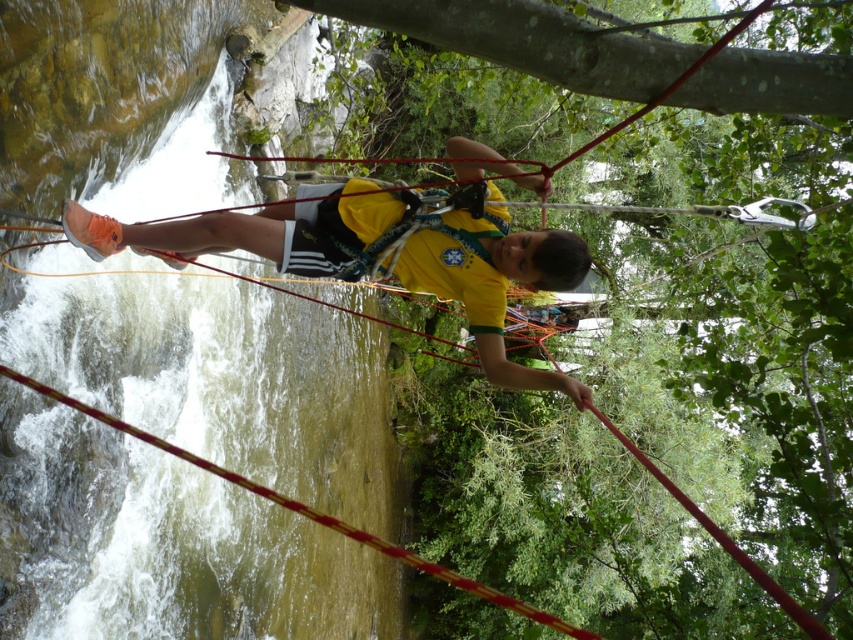
You are a safety inspector reviewing the setup for a ziplining activity. You notice the yellow matte shirt at center and the red nylon rope at center in the image. Based on their positions, which object is above the other?

The yellow matte shirt at center is positioned over the red nylon rope at center, meaning it is above the rope.

In the scene shown: You are a safety inspector checking the positioning of the yellow fabric safety vest at center in the image. According to the safety guidelines, the vest must be centered exactly at point 0.5 on both the x and y axes. Is the vest positioned correctly?

The yellow fabric safety vest at center is positioned at point 0.433 on the x axis and 0.532 on the y axis, which deviates from the required 0.5 on both axes. Therefore, the vest is not positioned correctly according to safety guidelines.